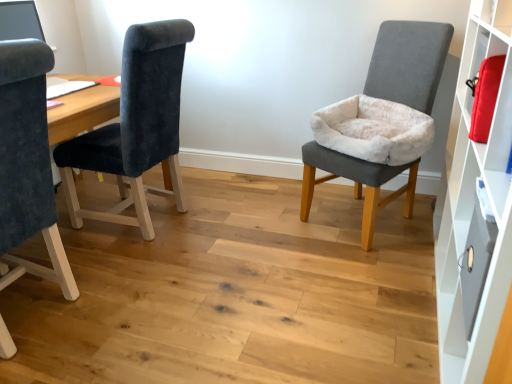
Find the location of a particular element. spots to the right of velvet dark blue chair at left, which is the 1th chair from left to right is located at coordinates (144, 315).